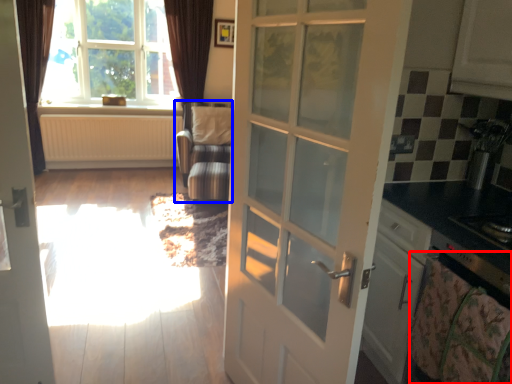
Question: Which point is closer to the camera, blanket (highlighted by a red box) or armchair (highlighted by a blue box)?

Choices:
 (A) blanket
 (B) armchair

Answer: (A)